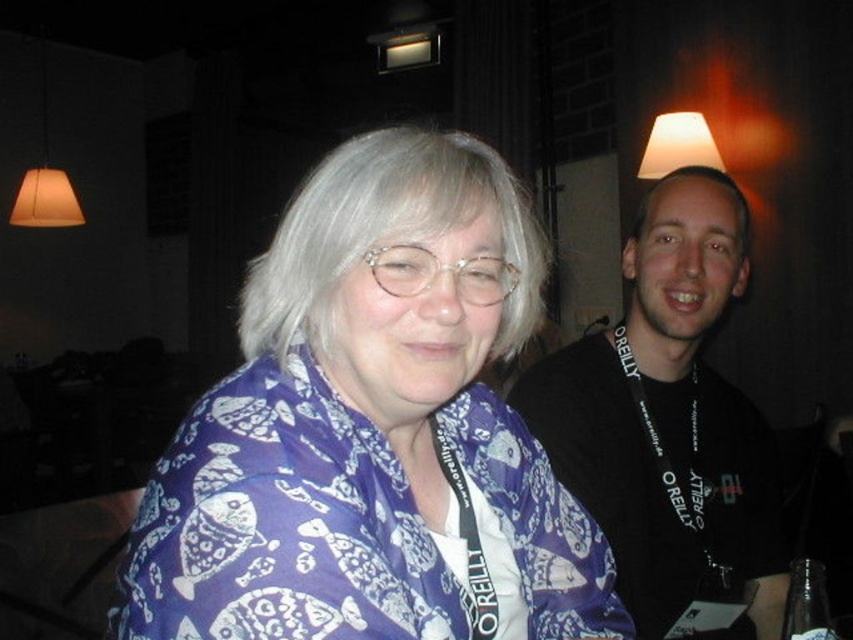
Question: Does matte orange lampshade at upper left lie behind matte white lampshade at upper center?

Choices:
 (A) yes
 (B) no

Answer: (A)

Question: Which point is farther to the camera?

Choices:
 (A) (730, 227)
 (B) (85, 525)

Answer: (B)

Question: Observing the image, what is the correct spatial positioning of purple printed scarf at center in reference to black lanyard at right?

Choices:
 (A) below
 (B) above

Answer: (B)

Question: Among these objects, which one is farthest from the camera?

Choices:
 (A) matte white lampshade at upper center
 (B) wooden table at lower left
 (C) black lanyard at right
 (D) matte orange lampshade at upper left

Answer: (D)

Question: Which point is closer to the camera?

Choices:
 (A) (84, 618)
 (B) (16, 214)
 (C) (331, 504)
 (D) (700, 132)

Answer: (C)

Question: Can you confirm if purple printed scarf at center is thinner than black lanyard at right?

Choices:
 (A) no
 (B) yes

Answer: (B)